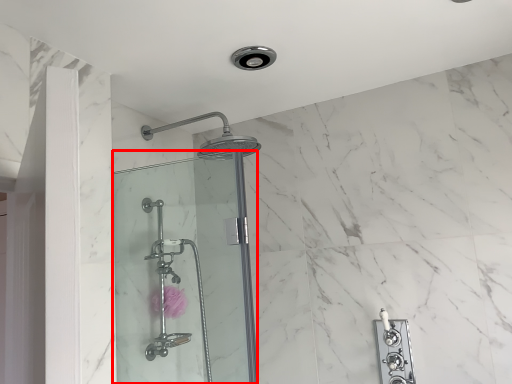
Question: From the image's perspective, what is the correct spatial positioning of shower door (annotated by the red box) in reference to flower?

Choices:
 (A) below
 (B) above

Answer: (B)